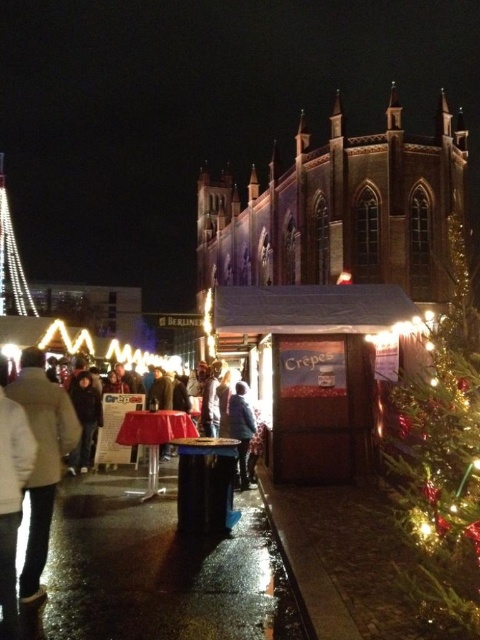
Image resolution: width=480 pixels, height=640 pixels. What do you see at coordinates (146, 568) in the screenshot?
I see `white matte jacket at lower left` at bounding box center [146, 568].

Between white matte jacket at lower left and green shiny christmas tree at right, which one has less height?

With less height is white matte jacket at lower left.

Describe the element at coordinates (146, 568) in the screenshot. I see `white matte jacket at lower left` at that location.

This screenshot has width=480, height=640. In order to click on white matte jacket at lower left in this screenshot , I will do `click(146, 568)`.